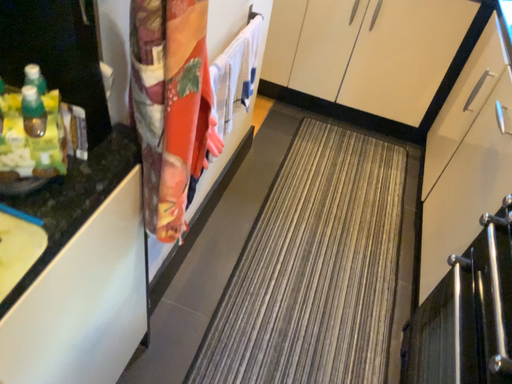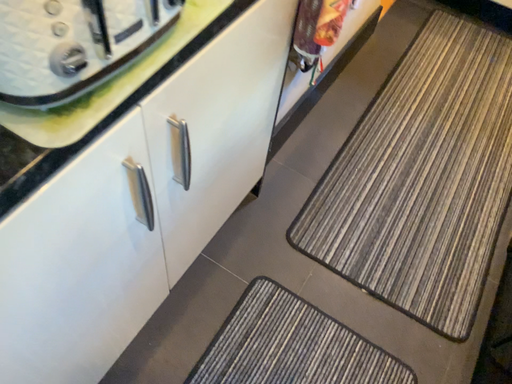
Question: How did the camera likely rotate when shooting the video?

Choices:
 (A) rotated right
 (B) rotated left

Answer: (B)